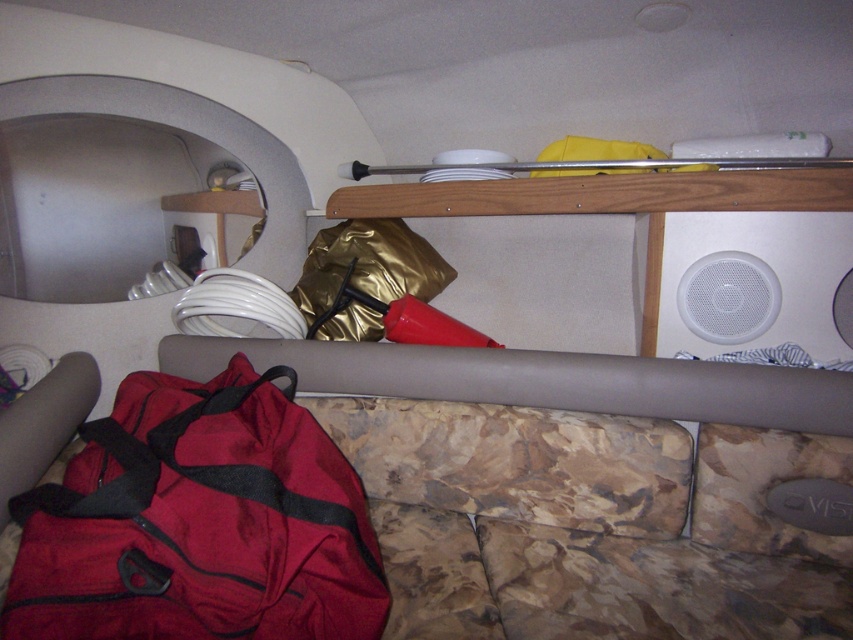
Question: Considering the real-world distances, which object is farthest from the wooden shelf at upper center?

Choices:
 (A) gray matte ledge at lower center
 (B) red fabric bag at lower left
 (C) red fabric duffel at lower left

Answer: (B)

Question: Considering the relative positions of red fabric bag at lower left and gray matte ledge at lower center in the image provided, where is red fabric bag at lower left located with respect to gray matte ledge at lower center?

Choices:
 (A) right
 (B) left

Answer: (B)

Question: Which of the following is the farthest from the observer?

Choices:
 (A) (830, 564)
 (B) (450, 355)
 (C) (828, 196)
 (D) (334, 488)

Answer: (B)

Question: Can you confirm if wooden shelf at upper center is bigger than gold metallic bag at center?

Choices:
 (A) yes
 (B) no

Answer: (A)

Question: Is red fabric bag at lower left wider than gray matte ledge at lower center?

Choices:
 (A) no
 (B) yes

Answer: (A)

Question: Which is nearer to the gray matte ledge at lower center?

Choices:
 (A) wooden shelf at upper center
 (B) gold metallic bag at center

Answer: (A)